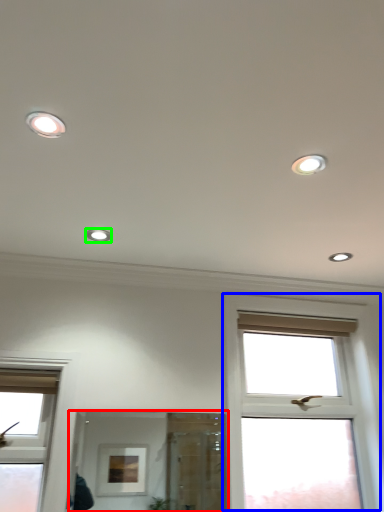
Question: Which object is the closest to the mirror (highlighted by a red box)? Choose among these: window (highlighted by a blue box) or dot (highlighted by a green box).

Choices:
 (A) window
 (B) dot

Answer: (A)